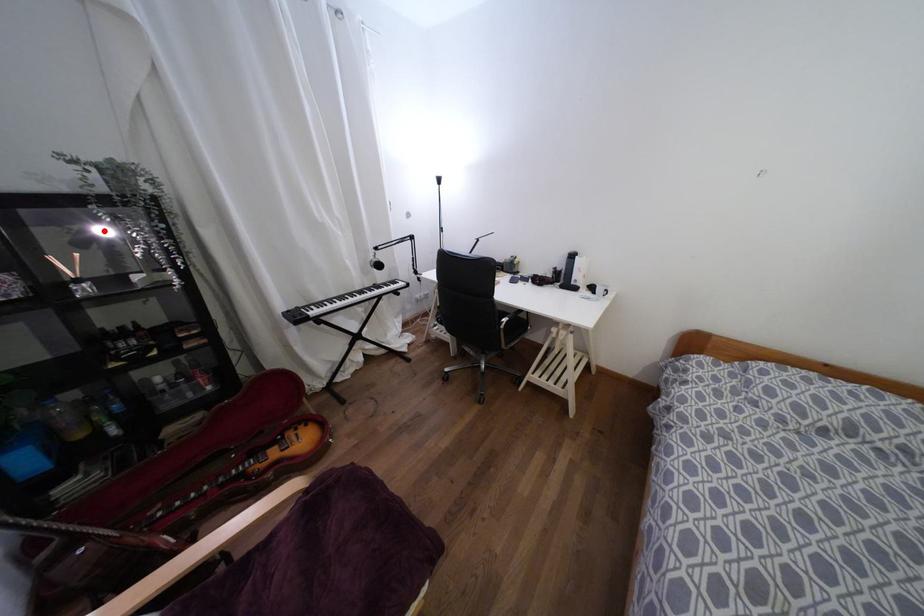
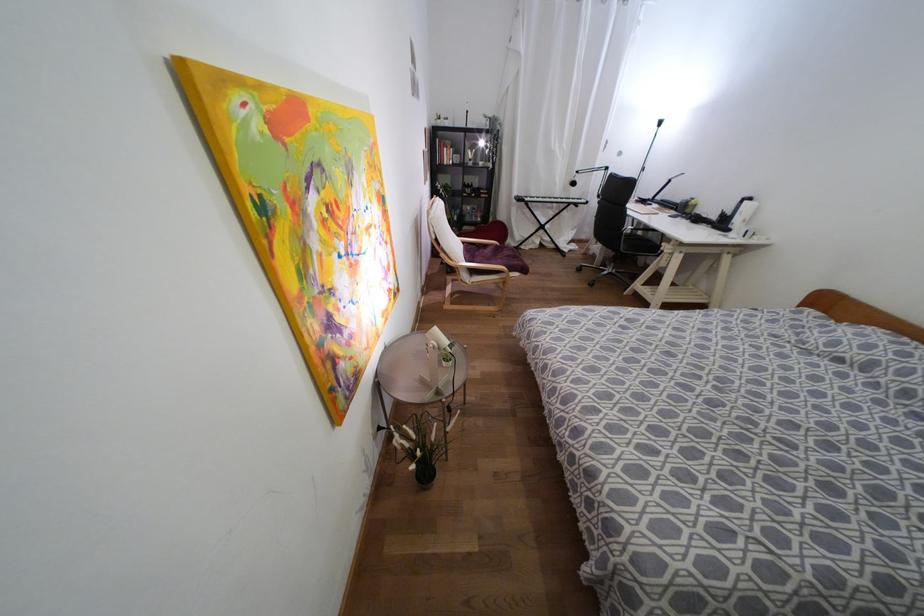
Question: I am providing you with two images of the same scene from different viewpoints. A red point is marked on the first image. At the location where the point appears in image 1, is it still visible in image 2?

Choices:
 (A) Yes
 (B) No

Answer: (A)